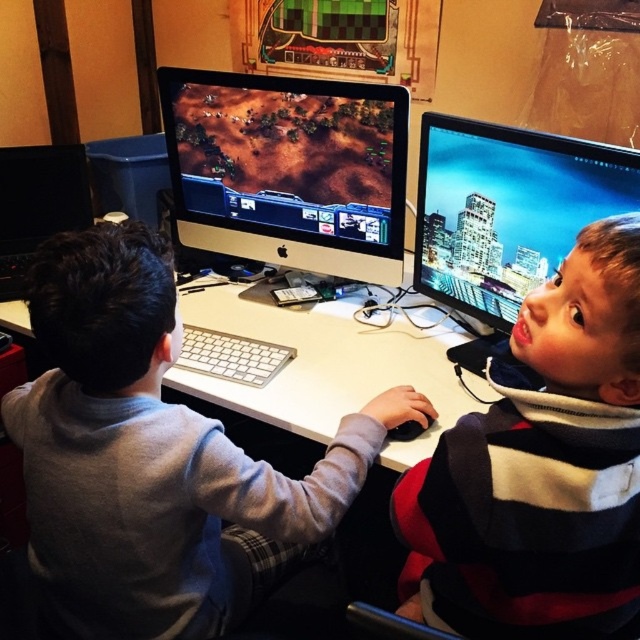
You are a delivery person who just arrived at the desk. You need to place a new monitor exactly at point [36,204]. Is there already a monitor at that location?

Yes, there is already a black glossy monitor at left at point [36,204].

You are a delivery person who needs to place a small package between the black glossy monitor at left and the white plastic keyboard at center. Can you fit it there?

The black glossy monitor at left is to the left of white plastic keyboard at center, so there is space between them to place the small package.